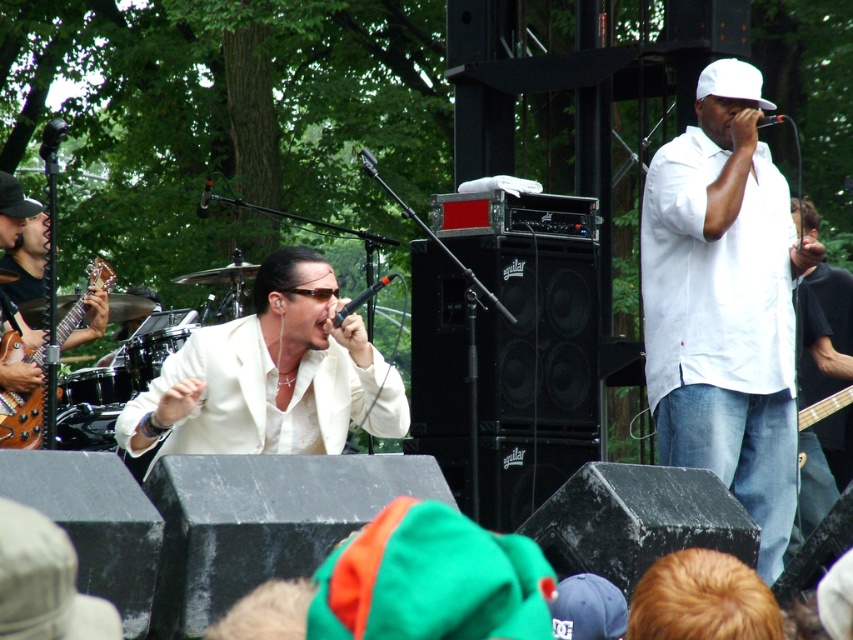
You are a photographer standing at the center of the stage. You want to take a photo of the white glossy suit at center. Where should you aim your camera to capture it perfectly?

The white glossy suit at center is located at the 2D coordinates point (271, 374), so you should aim your camera at that point to capture it perfectly.

You are a photographer standing at the camera position. You want to capture a closeup of the white matte shirt at upper right. Given that your camera has a maximum zoom range of 25 feet, can you achieve this without moving closer?

The white matte shirt at upper right is 27.08 feet from the camera, which exceeds the maximum zoom range of 25 feet. Therefore, you cannot capture a closeup without moving closer.

You are a photographer at the music event and want to capture a photo that includes both the white matte shirt at upper right and the white glossy suit at center. Based on their positions, which one should be placed higher in the photo?

The white matte shirt at upper right should be placed higher in the photo because it is positioned above the white glossy suit at center.